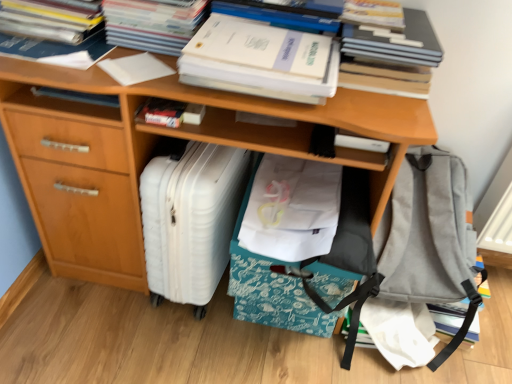
This screenshot has width=512, height=384. What are the coordinates of `free space in front of white paper at upper left, which is counted as the second book, starting from the left` in the screenshot? It's located at (41, 57).